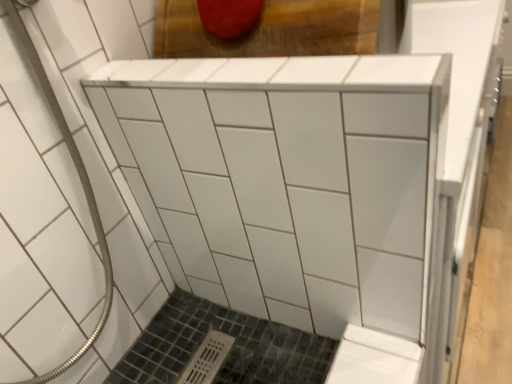
Find the location of a particular element. This screenshot has width=512, height=384. free space above white glossy cabinet at center (from a real-world perspective) is located at coordinates (245, 66).